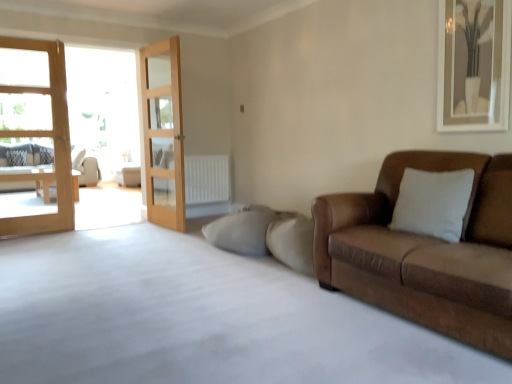
Question: Is beige fabric couch at left, the 1th studio couch in the left-to-right sequence, inside the boundaries of white textured pillow at left, or outside?

Choices:
 (A) inside
 (B) outside

Answer: (B)

Question: From the image's perspective, is beige fabric couch at left, positioned as the second studio couch in right-to-left order, above or below white textured pillow at left?

Choices:
 (A) below
 (B) above

Answer: (A)

Question: Considering the real-world distances, which object is farthest from the beige fabric couch at left, the 2th studio couch positioned from the front?

Choices:
 (A) wooden glass door at center, arranged as the 2th door when viewed from the left
 (B) brown leather couch at right, placed as the 1th studio couch when sorted from right to left
 (C) light brown wooden door at left, positioned as the first door in left-to-right order
 (D) white textured radiator at center
 (E) white textured pillow at left

Answer: (B)

Question: Which is nearer to the white textured radiator at center?

Choices:
 (A) wooden glass door at center, arranged as the 2th door when viewed from the left
 (B) brown leather couch at right, the first studio couch positioned from the front
 (C) beige fabric couch at left, positioned as the second studio couch in right-to-left order
 (D) light brown wooden door at left, which is the 2th door from right to left
 (E) white textured pillow at left

Answer: (A)